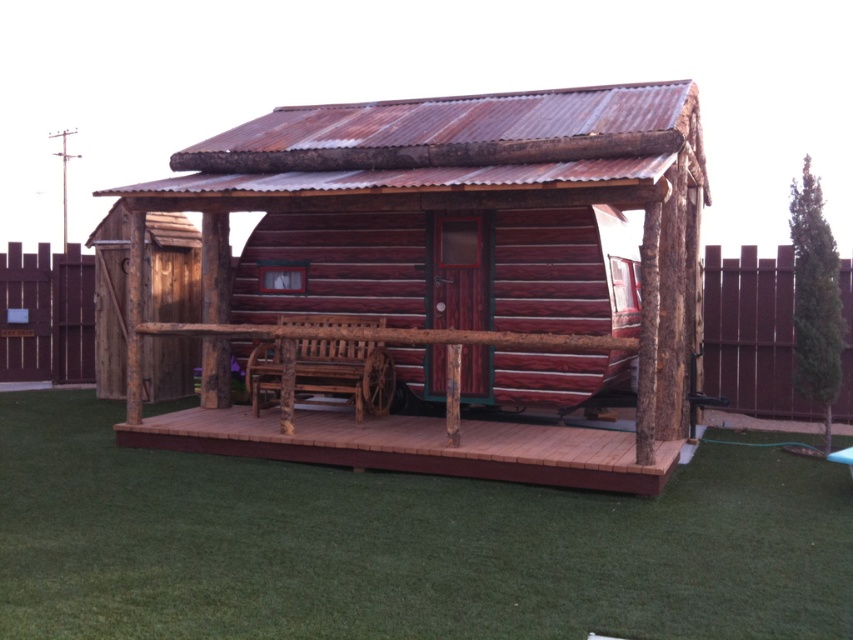
Does rustic wood cabin at center appear under brown wooden fence at center?

Indeed, rustic wood cabin at center is positioned under brown wooden fence at center.

Locate an element on the screen. The height and width of the screenshot is (640, 853). rustic wood cabin at center is located at coordinates (459, 269).

Does green grass at lower center lie behind rustic wood cabin at center?

That is False.

From the picture: Does green grass at lower center appear on the left side of rustic wood cabin at center?

Yes, green grass at lower center is to the left of rustic wood cabin at center.

Is point (753, 518) behind point (276, 141)?

That is False.

Where is `green grass at lower center`? The height and width of the screenshot is (640, 853). green grass at lower center is located at coordinates (401, 545).

Can you confirm if rustic wood cabin at center is thinner than brown wooden fence at right?

Correct, rustic wood cabin at center's width is less than brown wooden fence at right's.

Who is positioned more to the right, rustic wood cabin at center or brown wooden fence at right?

brown wooden fence at right

Is point (218, 406) positioned after point (712, 273)?

No.

At what (x,y) coordinates should I click in order to perform the action: click on rustic wood cabin at center. Please return your answer as a coordinate pair (x, y). Image resolution: width=853 pixels, height=640 pixels. Looking at the image, I should click on (459, 269).